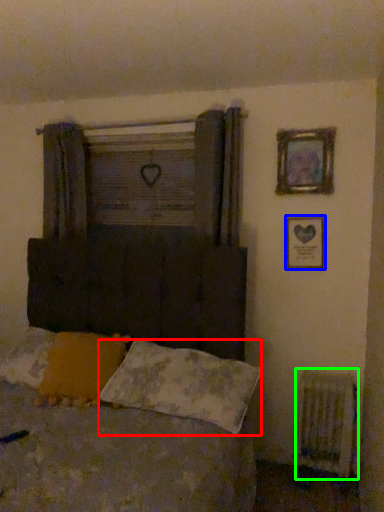
Question: Which is nearer to the pillow (highlighted by a red box)? picture frame (highlighted by a blue box) or radiator (highlighted by a green box).

Choices:
 (A) picture frame
 (B) radiator

Answer: (B)